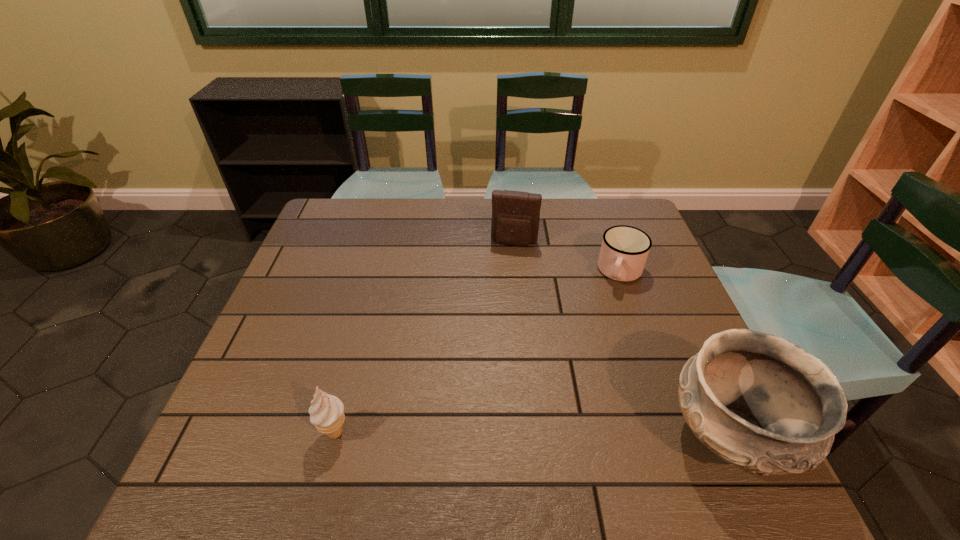
Where is `unoccupied position between the pottery and the leftmost object`? This screenshot has height=540, width=960. unoccupied position between the pottery and the leftmost object is located at coordinates (532, 434).

In order to click on free space between the mug and the farthest object in this screenshot , I will do `click(567, 258)`.

Image resolution: width=960 pixels, height=540 pixels. In order to click on empty location between the shortest object and the icecream in this screenshot , I will do `click(478, 352)`.

Find the location of a particular element. Image resolution: width=960 pixels, height=540 pixels. free area in between the icecream and the pottery is located at coordinates (532, 434).

Image resolution: width=960 pixels, height=540 pixels. Identify the location of free space between the icecream and the pouch. (424, 338).

What are the coordinates of `object that is the closest one to the pottery` in the screenshot? It's located at (624, 250).

I want to click on the third closest object to the pottery, so click(x=326, y=412).

Locate an element on the screen. The height and width of the screenshot is (540, 960). vacant region that satisfies the following two spatial constraints: 1. on the front side of the pottery; 2. on the right side of the farthest object is located at coordinates (532, 436).